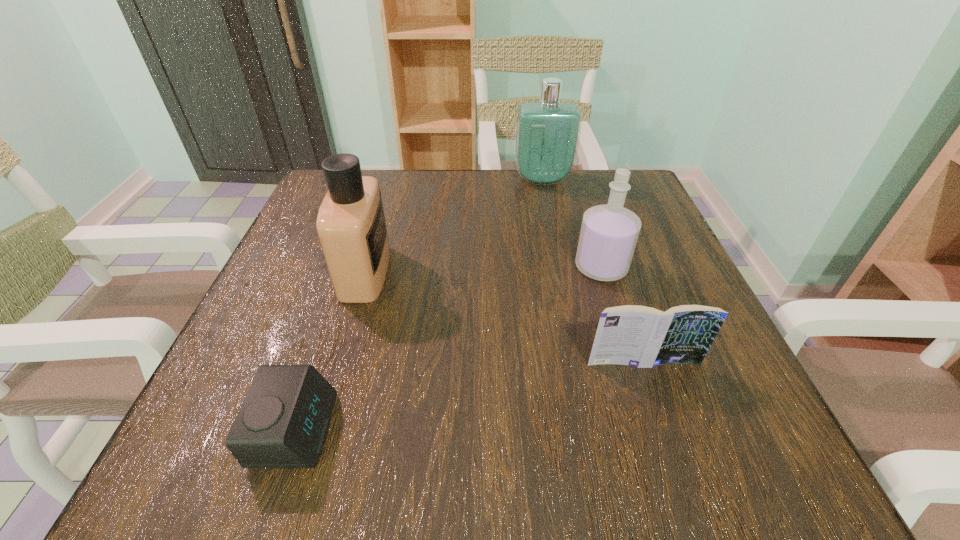
In the image, there is a desktop. Identify the location of free space at the far right corner. (634, 172).

Locate an element on the screen. This screenshot has height=540, width=960. vacant space in between the leftmost perfume and the book is located at coordinates (504, 318).

Locate an element on the screen. free space between the alarm clock and the fourth tallest object is located at coordinates (469, 396).

Locate an element on the screen. The height and width of the screenshot is (540, 960). empty location between the book and the shortest object is located at coordinates (469, 396).

Locate an element on the screen. This screenshot has width=960, height=540. vacant space in between the farthest object and the shortest object is located at coordinates (419, 304).

Find the location of a particular element. This screenshot has height=540, width=960. empty space between the second shortest object and the leftmost perfume is located at coordinates (504, 318).

At what (x,y) coordinates should I click in order to perform the action: click on vacant space that's between the leftmost perfume and the fourth tallest object. Please return your answer as a coordinate pair (x, y). This screenshot has height=540, width=960. Looking at the image, I should click on (504, 318).

You are a GUI agent. You are given a task and a screenshot of the screen. Output one action in this format:
    pyautogui.click(x=<x>, y=<y>)
    Task: Click on the object that is the second closest to the farthest perfume
    This screenshot has width=960, height=540.
    Given the screenshot: What is the action you would take?
    pyautogui.click(x=351, y=226)

The image size is (960, 540). What are the coordinates of `object that ranks as the second closest to the farthest object` in the screenshot? It's located at (351, 226).

Identify which perfume is located as the third nearest to the alarm clock. Please provide its 2D coordinates. Your answer should be formatted as a tuple, i.e. [(x, y)], where the tuple contains the x and y coordinates of a point satisfying the conditions above.

[(547, 133)]